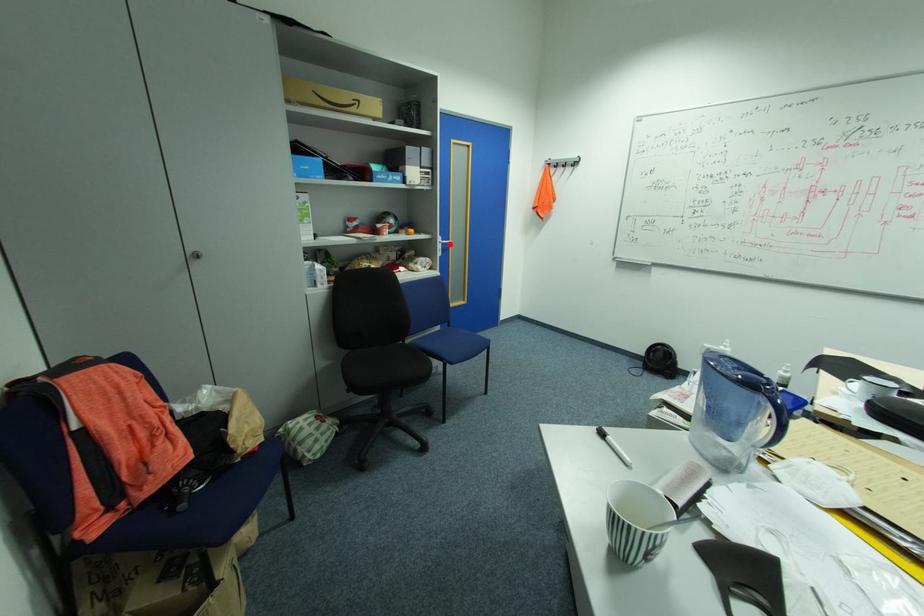
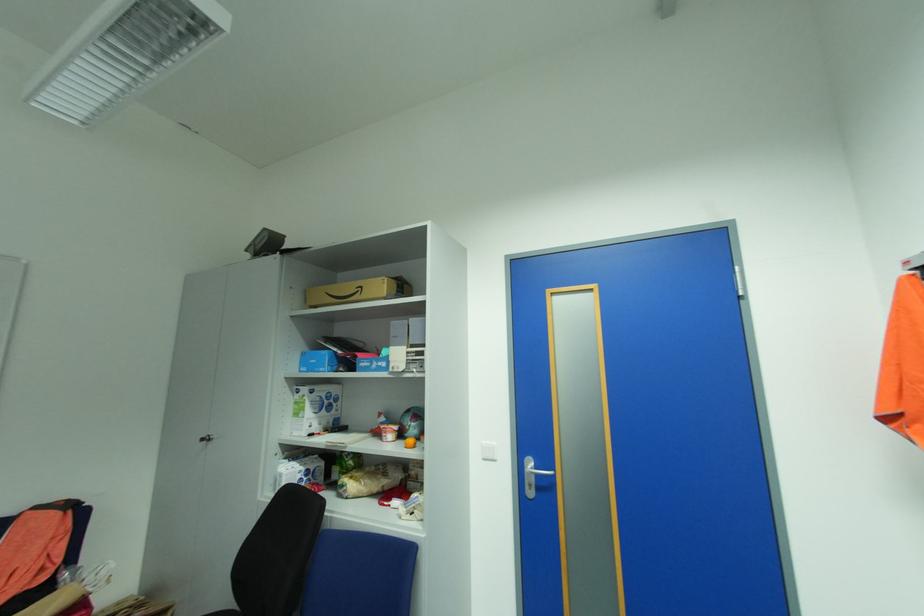
Find the pixel in the second image that matches the highlighted location in the first image.

(543, 475)